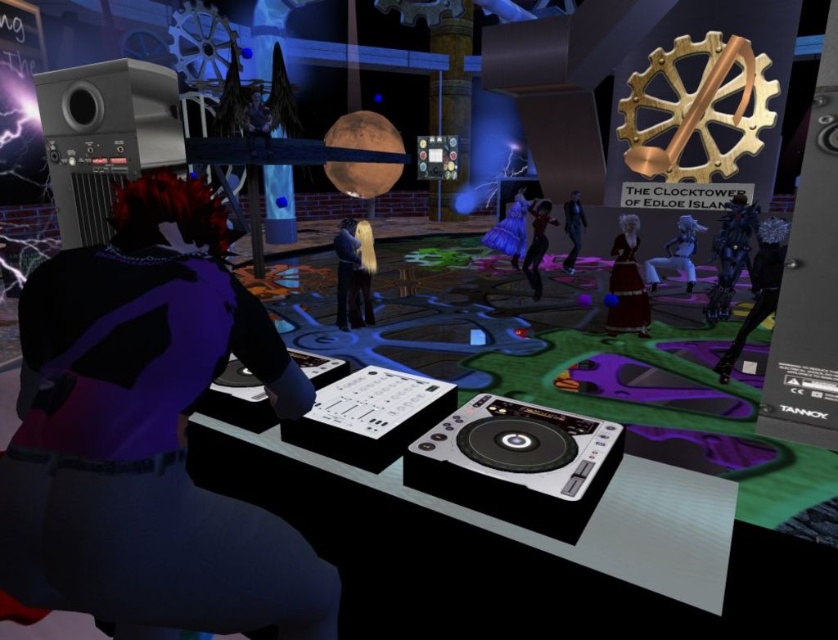
Based on the photo, you are a fashion designer observing the scene and want to create a new collection based on the outfits seen here. Given that the matte red dress at center and shiny black suit at center are central to the design, which of these two items would you prioritize in terms of space they take up in the collection layout?

The shiny black suit at center occupies more space than the matte red dress at center, so it should be prioritized in the collection layout to accommodate its larger size.